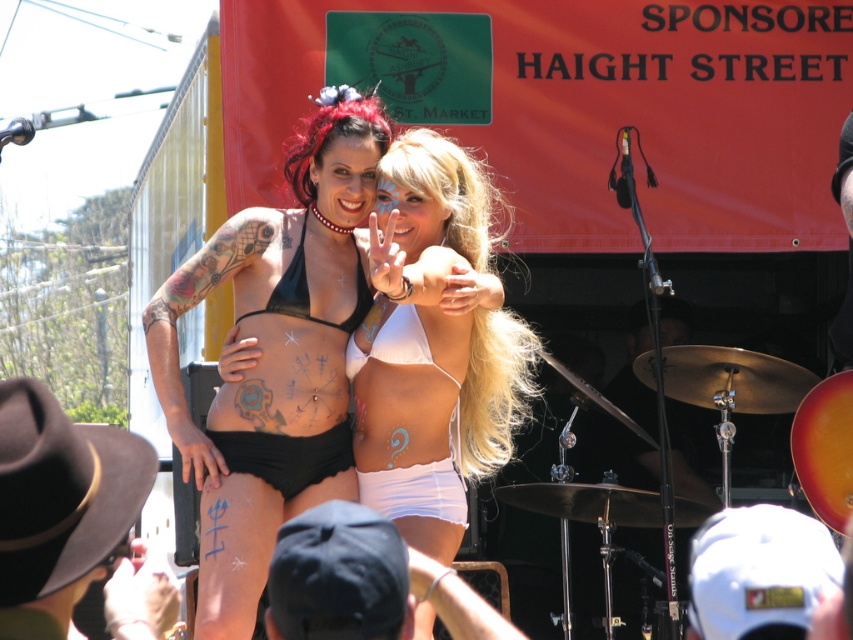
Question: Which point is farther from the camera taking this photo?

Choices:
 (A) (482, 464)
 (B) (422, 584)
 (C) (239, 518)
 (D) (766, 634)

Answer: (A)

Question: Which point is farther to the camera?

Choices:
 (A) (694, 544)
 (B) (389, 410)
 (C) (343, 230)
 (D) (425, 560)

Answer: (A)

Question: Is white matte bikini top at center smaller than white matte guitar at center?

Choices:
 (A) no
 (B) yes

Answer: (A)

Question: Which of the following is the closest to the observer?

Choices:
 (A) white matte guitar at center
 (B) pearl necklace at center
 (C) white matte bikini at center

Answer: (A)

Question: Does brown felt hat at lower left appear over white matte bikini at center?

Choices:
 (A) yes
 (B) no

Answer: (A)

Question: Does white matte bikini top at center appear on the right side of white fabric cap at center?

Choices:
 (A) no
 (B) yes

Answer: (A)